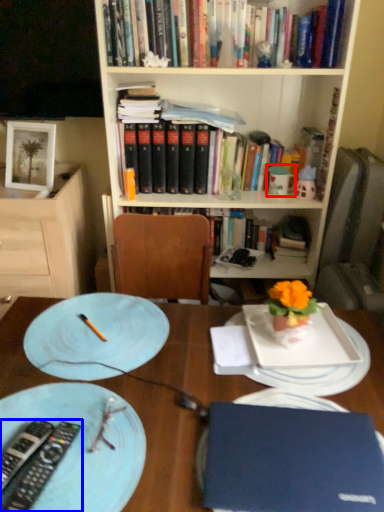
Question: Which of the following is the farthest to the observer, tableware (highlighted by a red box) or remote control (highlighted by a blue box)?

Choices:
 (A) tableware
 (B) remote control

Answer: (A)